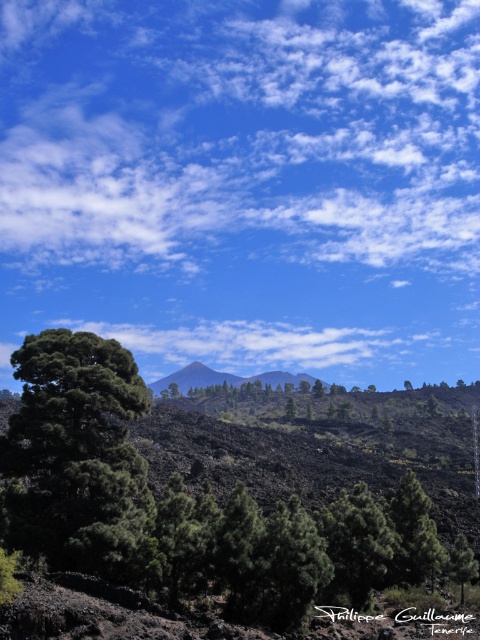
You are planning to set up a tent for a camping trip and need to choose between two locations. One is near the dark green leafy tree at lower left, and the other is near the matte black mountain at center. Considering the height differences between these two objects, which location would provide better visibility of the surrounding landscape?

The matte black mountain at center is taller than the dark green leafy tree at lower left. Setting up the tent near the matte black mountain at center would provide better visibility of the surrounding landscape because it is higher in elevation.